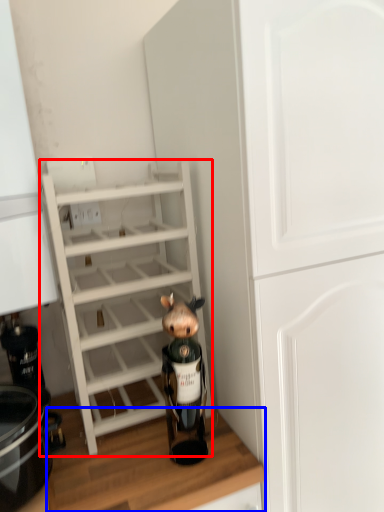
Question: Which object is closer to the camera taking this photo, shelf (highlighted by a red box) or counter top (highlighted by a blue box)?

Choices:
 (A) shelf
 (B) counter top

Answer: (B)